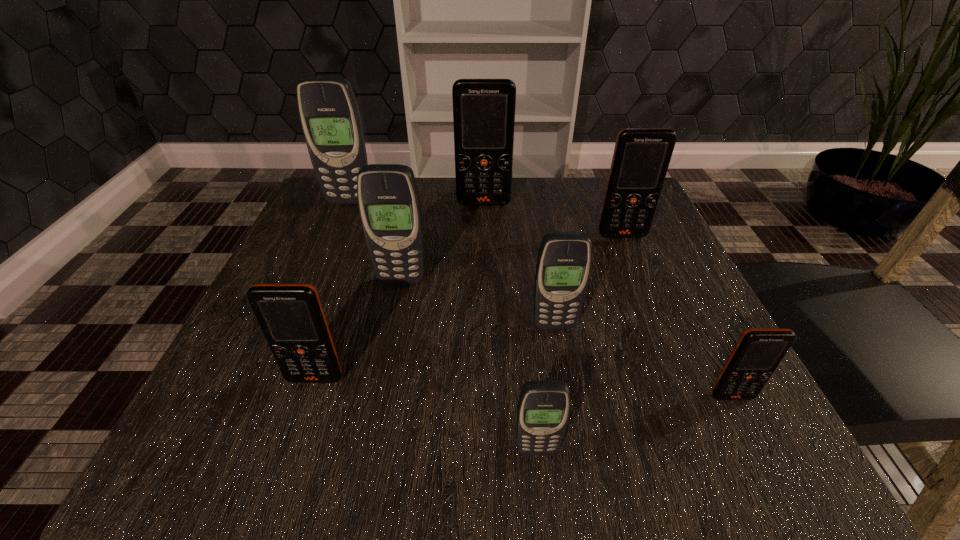
The image size is (960, 540). I want to click on free space at the near left corner, so click(250, 440).

Identify the location of free space at the far right corner of the desktop. [588, 207].

Where is `vacant space at the near right corner of the desktop`? This screenshot has width=960, height=540. vacant space at the near right corner of the desktop is located at coordinates (721, 453).

At what (x,y) coordinates should I click in order to perform the action: click on free area in between the biggest orange cellular telephone and the second smallest orange cellular telephone. Please return your answer as a coordinate pair (x, y). Image resolution: width=960 pixels, height=540 pixels. Looking at the image, I should click on (399, 291).

At what (x,y) coordinates should I click in order to perform the action: click on free area in between the leftmost gray cellular telephone and the smallest gray cellular telephone. Please return your answer as a coordinate pair (x, y). Looking at the image, I should click on (443, 326).

Locate an element on the screen. unoccupied area between the second nearest gray cellular telephone and the smallest orange cellular telephone is located at coordinates (643, 361).

Locate an element on the screen. The image size is (960, 540). free space between the second biggest gray cellular telephone and the smallest orange cellular telephone is located at coordinates (566, 339).

This screenshot has width=960, height=540. I want to click on vacant space in between the seventh farthest cellular telephone and the third orange cellular telephone from right to left, so click(x=608, y=300).

The image size is (960, 540). I want to click on free space between the sixth farthest object and the fourth nearest object, so click(435, 352).

You are a GUI agent. You are given a task and a screenshot of the screen. Output one action in this format:
    pyautogui.click(x=<x>, y=<y>)
    Task: Click on the vacant region between the sixth nearest object and the biggest gray cellular telephone
    The image size is (960, 540).
    Given the screenshot: What is the action you would take?
    pyautogui.click(x=486, y=219)